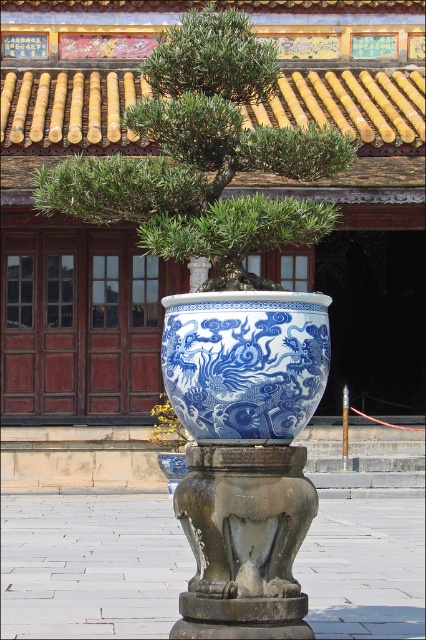
Question: Which point is closer to the camera?

Choices:
 (A) blue porcelain vase at center
 (B) green leafy tree at center

Answer: (A)

Question: Can you confirm if green leafy tree at center is thinner than blue porcelain vase at center?

Choices:
 (A) yes
 (B) no

Answer: (A)

Question: Can you confirm if green leafy tree at center is thinner than blue porcelain vase at center?

Choices:
 (A) no
 (B) yes

Answer: (B)

Question: Does green leafy tree at center have a lesser width compared to blue porcelain vase at center?

Choices:
 (A) yes
 (B) no

Answer: (A)

Question: Which point appears closest to the camera in this image?

Choices:
 (A) (192, 72)
 (B) (305, 408)

Answer: (B)